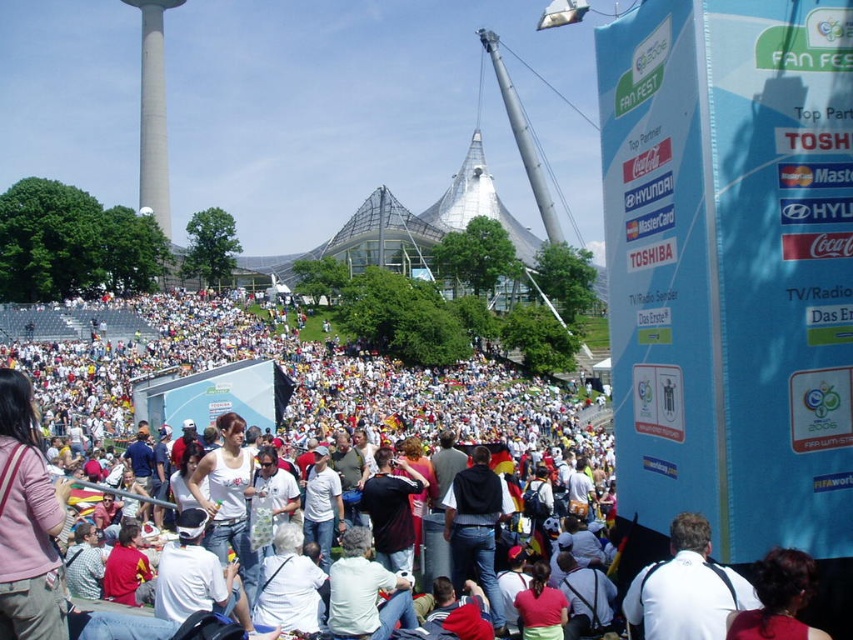
From the picture: You are a photographer at the FAN FEST event, and you want to capture a photo of the crowd. You notice two people wearing white clothing at the center of the scene. How far apart are the white casual clothing at center and the white fabric shirt at center?

The distance between the white casual clothing at center and the white fabric shirt at center is 57.51 meters.